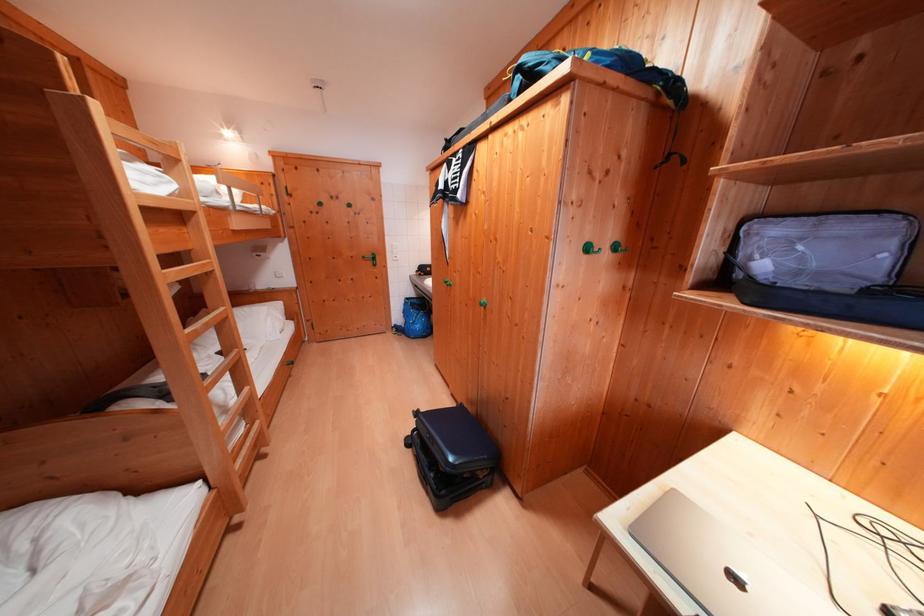
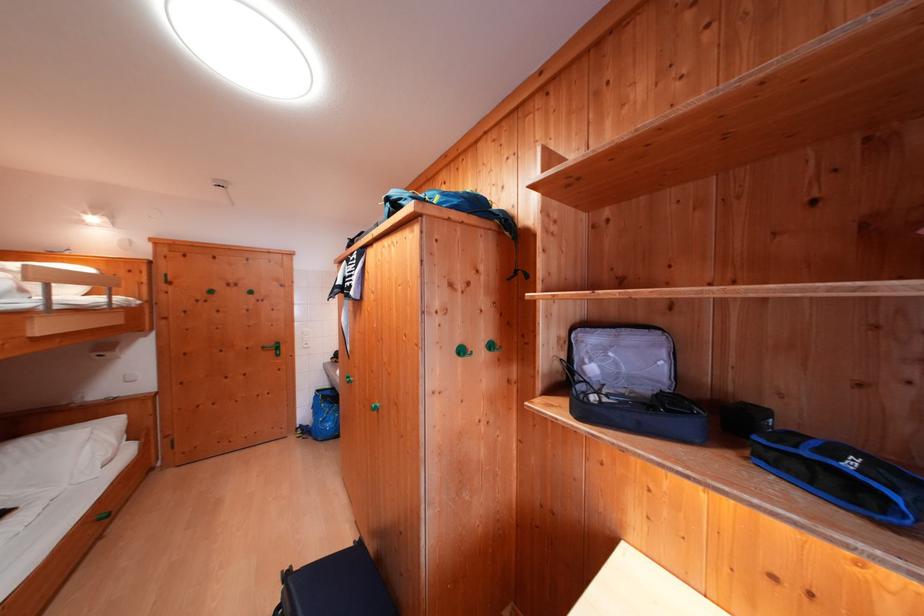
Where in the second image is the point corresponding to the point at 596,253 from the first image?

(469, 355)